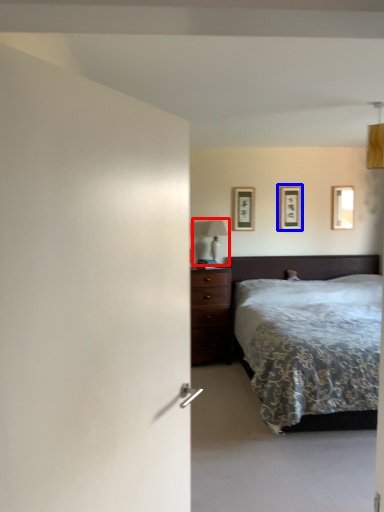
Question: Which object appears farthest to the camera in this image, table lamp (highlighted by a red box) or picture frame (highlighted by a blue box)?

Choices:
 (A) table lamp
 (B) picture frame

Answer: (B)